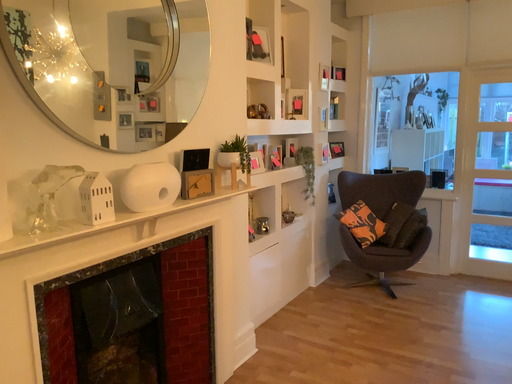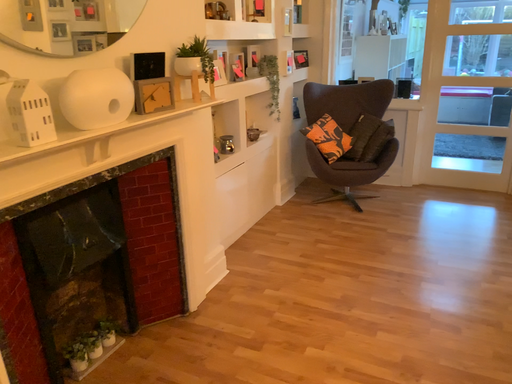
Question: How did the camera likely rotate when shooting the video?

Choices:
 (A) rotated downward
 (B) rotated upward

Answer: (A)